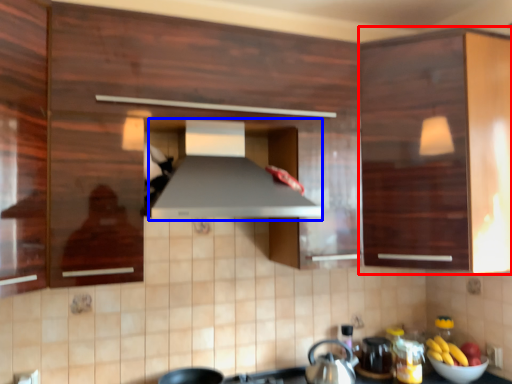
Question: Which point is closer to the camera, cabinetry (highlighted by a red box) or exhaust hood (highlighted by a blue box)?

Choices:
 (A) cabinetry
 (B) exhaust hood

Answer: (B)